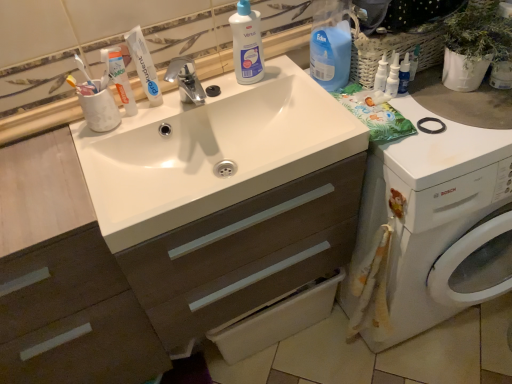
This screenshot has height=384, width=512. Identify the location of unoccupied region to the right of white glossy spray bottle at upper right, the fourth cleaning product from the left. (448, 96).